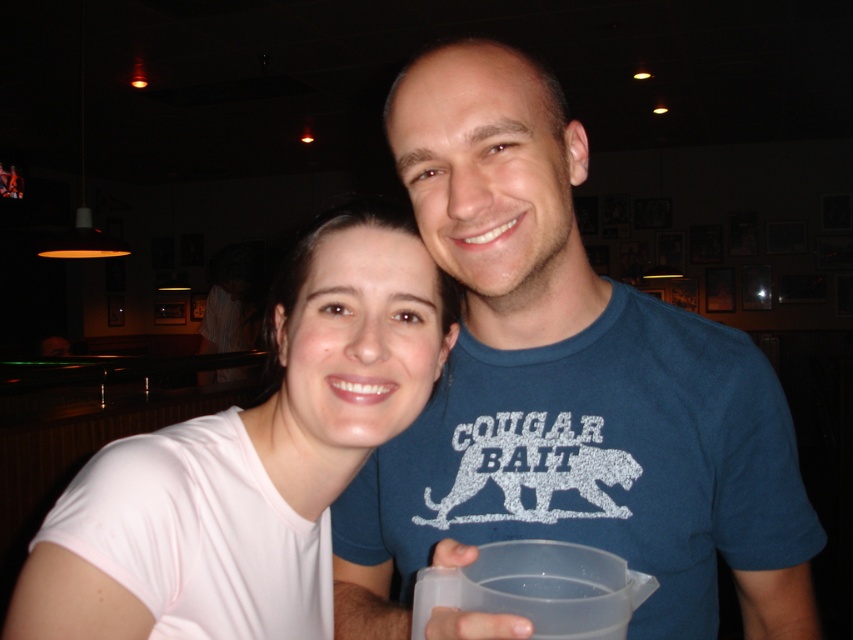
Question: Where is blue cotton t-shirt at upper center located in relation to white matte shirt at center in the image?

Choices:
 (A) right
 (B) left

Answer: (A)

Question: Does blue cotton t-shirt at upper center lie in front of white matte shirt at center?

Choices:
 (A) no
 (B) yes

Answer: (B)

Question: Does blue cotton t-shirt at upper center appear on the left side of white matte shirt at center?

Choices:
 (A) yes
 (B) no

Answer: (B)